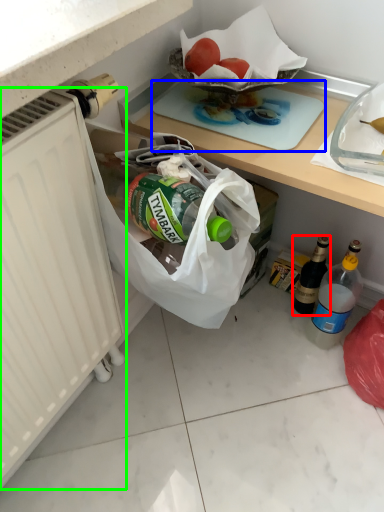
Question: Based on their relative distances, which object is farther from bottle (highlighted by a red box)? Choose from cutting board (highlighted by a blue box) and radiator (highlighted by a green box).

Choices:
 (A) cutting board
 (B) radiator

Answer: (B)